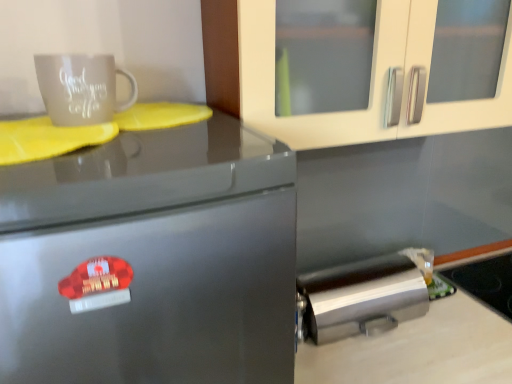
I want to click on unoccupied area in front of brushed metal trash can at lower right, so click(x=389, y=361).